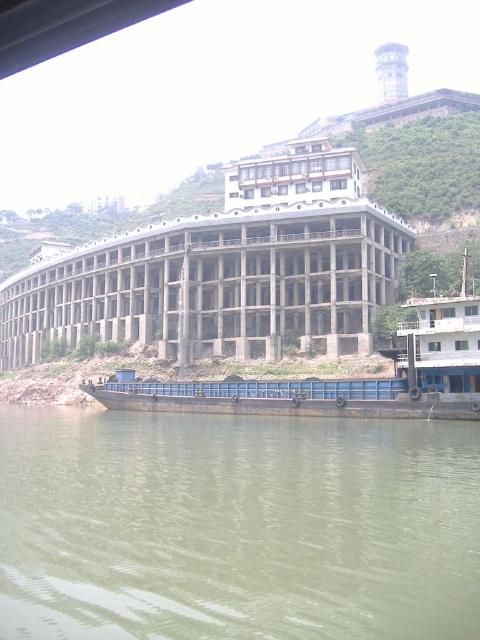
Which is below, green murky water at lower center or rusty metal barge at lower right?

Positioned lower is green murky water at lower center.

Does green murky water at lower center have a greater width compared to rusty metal barge at lower right?

No, green murky water at lower center is not wider than rusty metal barge at lower right.

Does point (24, 449) come farther from viewer compared to point (414, 364)?

No, (24, 449) is closer to viewer.

Find the location of a particular element. This screenshot has height=640, width=480. green murky water at lower center is located at coordinates (237, 525).